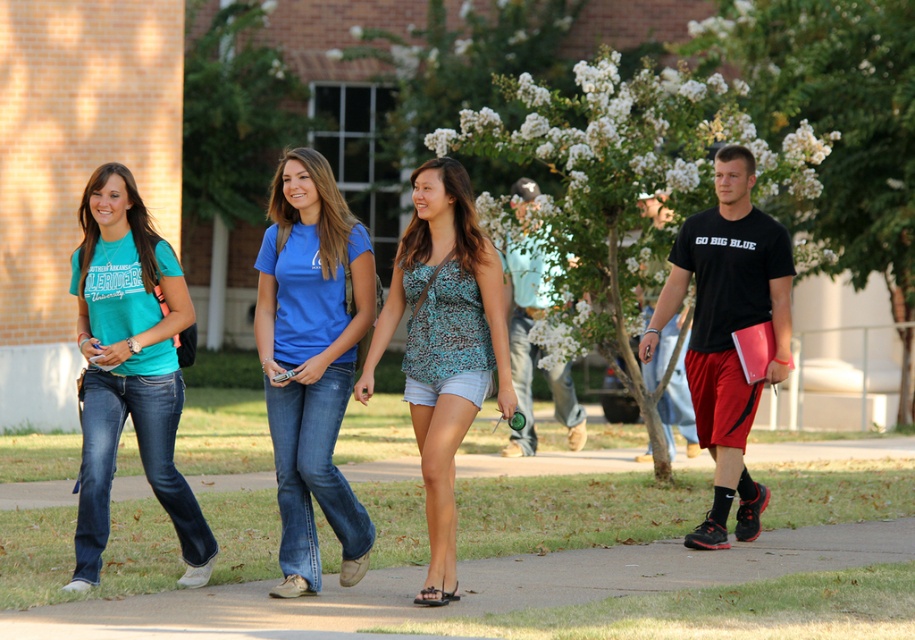
Question: Is matte teal t-shirt at left wider than black matte t-shirt at center?

Choices:
 (A) yes
 (B) no

Answer: (B)

Question: Based on their relative distances, which object is nearer to the black matte t-shirt at center?

Choices:
 (A) blue denim jeans at center
 (B) leopard print tank top at center

Answer: (B)

Question: Can you confirm if matte teal t-shirt at left is thinner than black matte t-shirt at center?

Choices:
 (A) no
 (B) yes

Answer: (B)

Question: Which object is positioned farthest from the concrete sidewalk at lower center?

Choices:
 (A) leopard print tank top at center
 (B) black matte t-shirt at center
 (C) blue denim jeans at center
 (D) matte teal t-shirt at left

Answer: (D)

Question: Which of the following is the farthest from the observer?

Choices:
 (A) (483, 257)
 (B) (95, 321)
 (C) (270, 243)

Answer: (C)

Question: Can you confirm if concrete sidewalk at lower center is bigger than blue denim jeans at center?

Choices:
 (A) yes
 (B) no

Answer: (B)